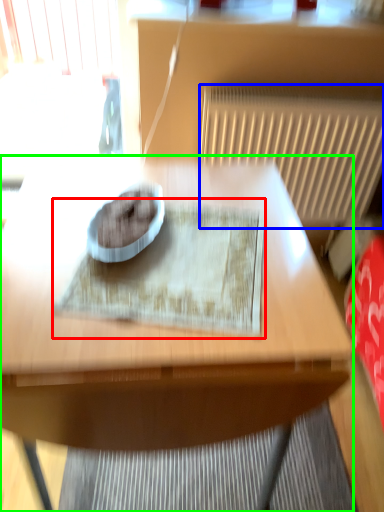
Question: Which is nearer to the mat (highlighted by a red box)? radiator (highlighted by a blue box) or table (highlighted by a green box).

Choices:
 (A) radiator
 (B) table

Answer: (B)